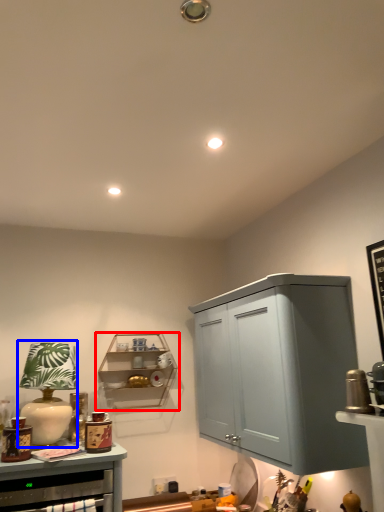
Question: Among these objects, which one is nearest to the camera, shelf (highlighted by a red box) or table lamp (highlighted by a blue box)?

Choices:
 (A) shelf
 (B) table lamp

Answer: (B)